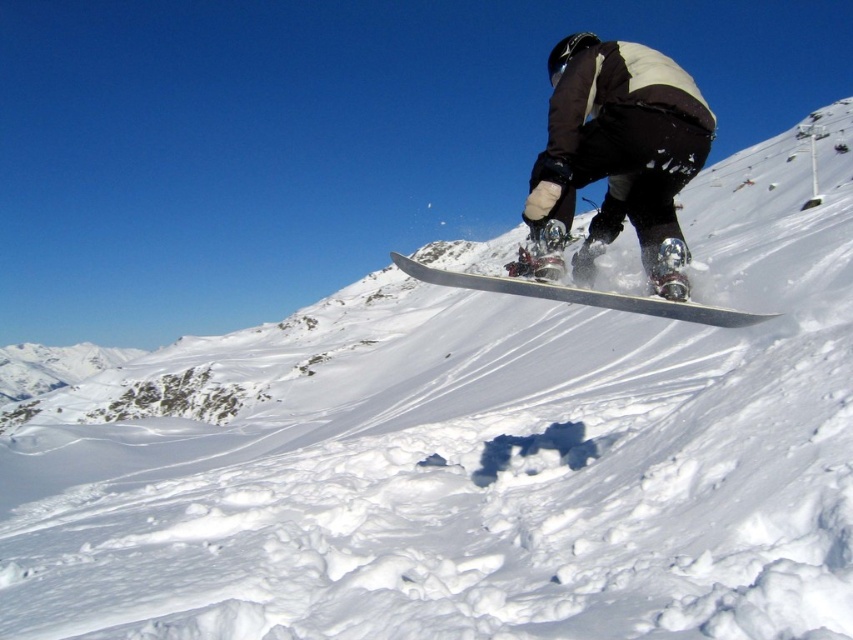
Question: Which object is closer to the camera taking this photo?

Choices:
 (A) white matte snowboard at center
 (B) black matte snowboarder at center
 (C) silver metallic snowboard at center

Answer: (C)

Question: Can you confirm if white matte snowboard at center is positioned above silver metallic snowboard at center?

Choices:
 (A) yes
 (B) no

Answer: (A)

Question: Is white matte snowboard at center positioned in front of black matte snowboarder at center?

Choices:
 (A) no
 (B) yes

Answer: (B)

Question: Estimate the real-world distances between objects in this image. Which object is farther from the silver metallic snowboard at center?

Choices:
 (A) black matte snowboarder at center
 (B) white matte snowboard at center

Answer: (A)

Question: Is white matte snowboard at center wider than silver metallic snowboard at center?

Choices:
 (A) yes
 (B) no

Answer: (B)

Question: Based on their relative distances, which object is nearer to the black matte snowboarder at center?

Choices:
 (A) silver metallic snowboard at center
 (B) white matte snowboard at center

Answer: (B)